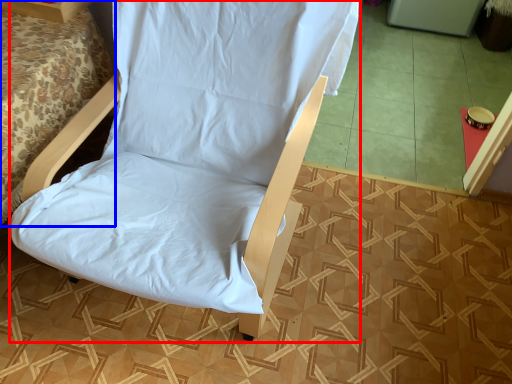
Question: Among these objects, which one is nearest to the camera, furnurniture (highlighted by a red box) or bed (highlighted by a blue box)?

Choices:
 (A) furnurniture
 (B) bed

Answer: (A)